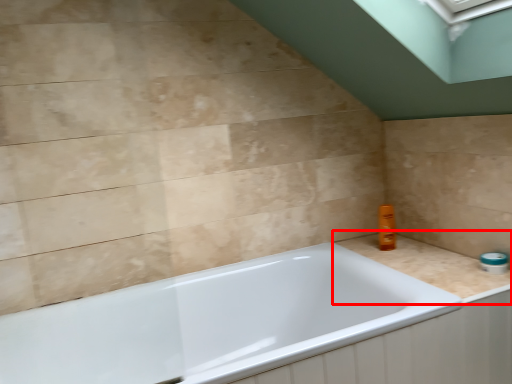
Question: Where is counter top (annotated by the red box) located in relation to bathtub in the image?

Choices:
 (A) left
 (B) right

Answer: (B)